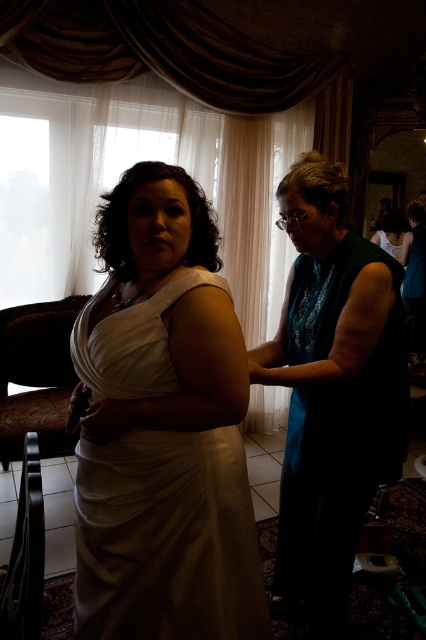
Between white satin dress at center and white sheer curtain at upper center, which one has more height?

white sheer curtain at upper center

Can you confirm if white satin dress at center is positioned to the left of white sheer curtain at upper center?

Incorrect, white satin dress at center is not on the left side of white sheer curtain at upper center.

This screenshot has height=640, width=426. What do you see at coordinates (163, 428) in the screenshot?
I see `white satin dress at center` at bounding box center [163, 428].

Identify the location of white satin dress at center. (163, 428).

From the picture: Is teal sequined dress at right to the right of matte black dress at center from the viewer's perspective?

Incorrect, teal sequined dress at right is not on the right side of matte black dress at center.

Who is higher up, teal sequined dress at right or matte black dress at center?

matte black dress at center

Which is in front, point (281, 595) or point (394, 246)?

Point (281, 595) is more forward.

Identify the location of teal sequined dress at right. (331, 392).

Which is behind, point (152, 20) or point (394, 211)?

The point (394, 211) is more distant.

Who is more forward, (250, 44) or (391, 220)?

Positioned in front is point (250, 44).

The image size is (426, 640). Identify the location of white sheer curtain at upper center. (178, 58).